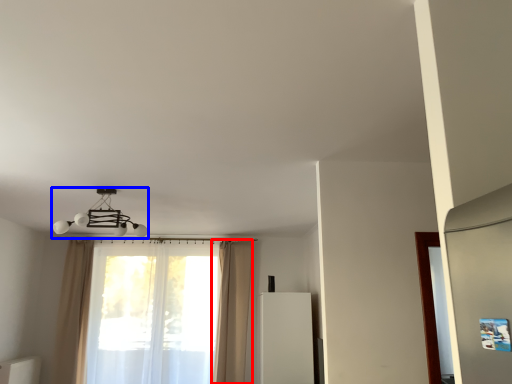
Question: Which of the following is the farthest to the observer, curtain (highlighted by a red box) or lamp (highlighted by a blue box)?

Choices:
 (A) curtain
 (B) lamp

Answer: (A)